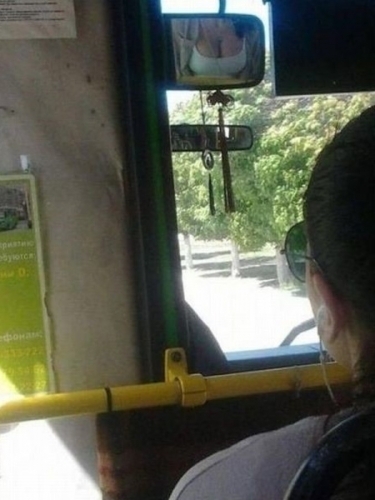
Locate an element on the screen. Image resolution: width=375 pixels, height=500 pixels. tassel is located at coordinates (225, 163).